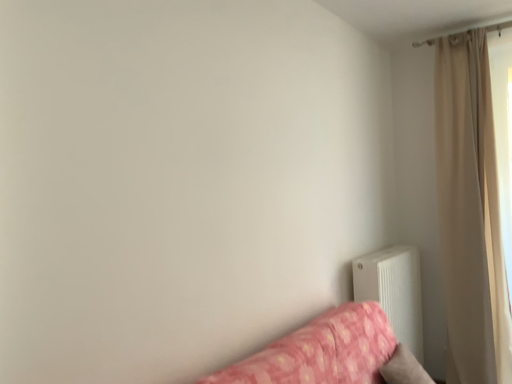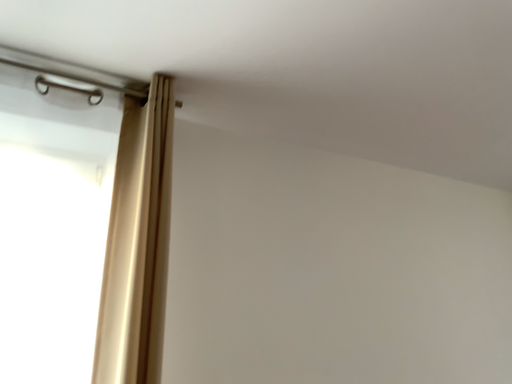
Question: How did the camera likely rotate when shooting the video?

Choices:
 (A) rotated upward
 (B) rotated downward

Answer: (A)